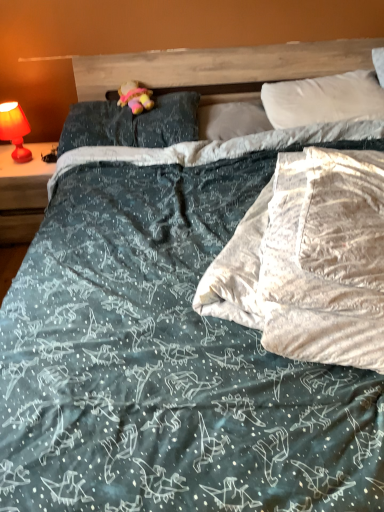
Locate an element on the screen. This screenshot has width=384, height=512. vacant area situated below matte red lamp at left (from a real-world perspective) is located at coordinates (21, 163).